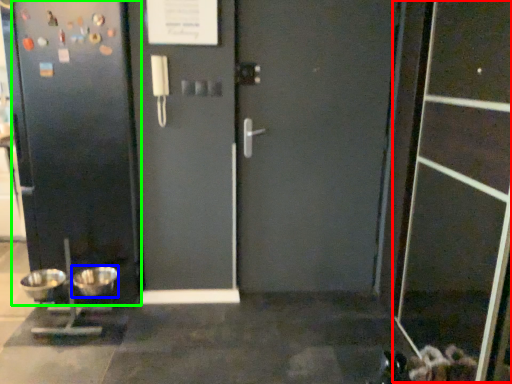
Question: Based on their relative distances, which object is nearer to screen door (highlighted by a red box)? Choose from mixing bowl (highlighted by a blue box) and door (highlighted by a green box).

Choices:
 (A) mixing bowl
 (B) door

Answer: (B)